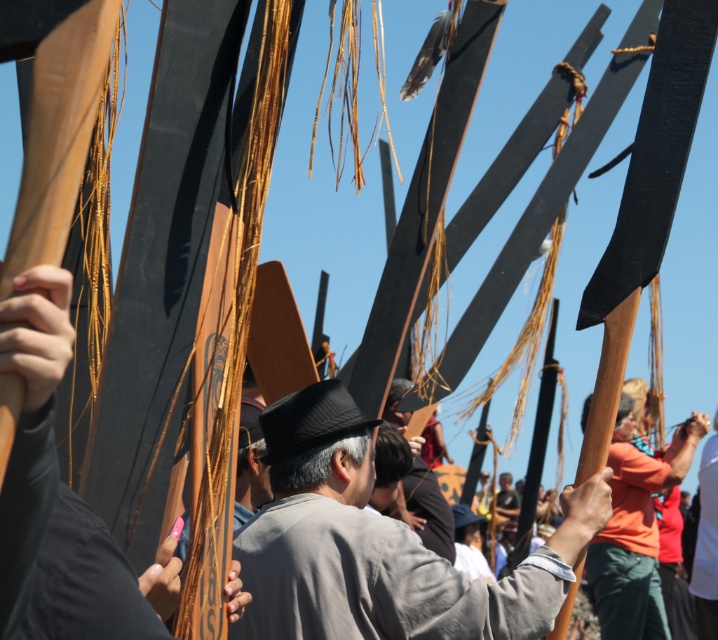
From the picture: Does gray fabric shirt at center come behind orange t-shirt at right?

That is True.

Which is above, gray fabric shirt at center or orange t-shirt at right?

Positioned higher is gray fabric shirt at center.

Who is more distant from viewer, (355, 557) or (643, 541)?

The point (643, 541) is behind.

Where is `gray fabric shirt at center`? This screenshot has width=718, height=640. gray fabric shirt at center is located at coordinates tap(378, 545).

Between gray fabric shirt at center and wooden board at center, which one appears on the left side from the viewer's perspective?

Positioned to the left is wooden board at center.

Does gray fabric shirt at center have a smaller size compared to wooden board at center?

No, gray fabric shirt at center is not smaller than wooden board at center.

Where is `gray fabric shirt at center`? The width and height of the screenshot is (718, 640). gray fabric shirt at center is located at coordinates (378, 545).

Can you confirm if orange t-shirt at right is shorter than black textured hat at center?

Incorrect, orange t-shirt at right's height does not fall short of black textured hat at center's.

Is orange t-shirt at right thinner than black textured hat at center?

No, orange t-shirt at right is not thinner than black textured hat at center.

Which is behind, point (633, 412) or point (349, 426)?

Positioned behind is point (633, 412).

You are a GUI agent. You are given a task and a screenshot of the screen. Output one action in this format:
    pyautogui.click(x=<x>, y=<y>)
    Task: Click on the orange t-shirt at right
    
    Given the screenshot: What is the action you would take?
    pos(635,531)